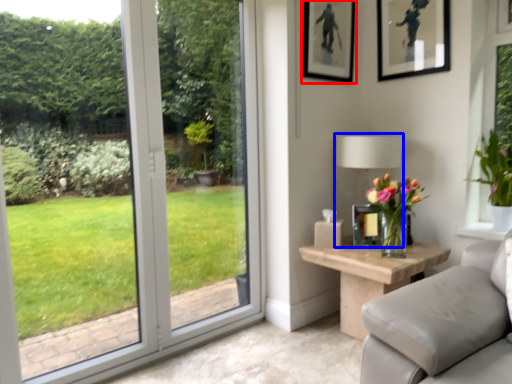
Question: Among these objects, which one is farthest to the camera, picture frame (highlighted by a red box) or table lamp (highlighted by a blue box)?

Choices:
 (A) picture frame
 (B) table lamp

Answer: (A)